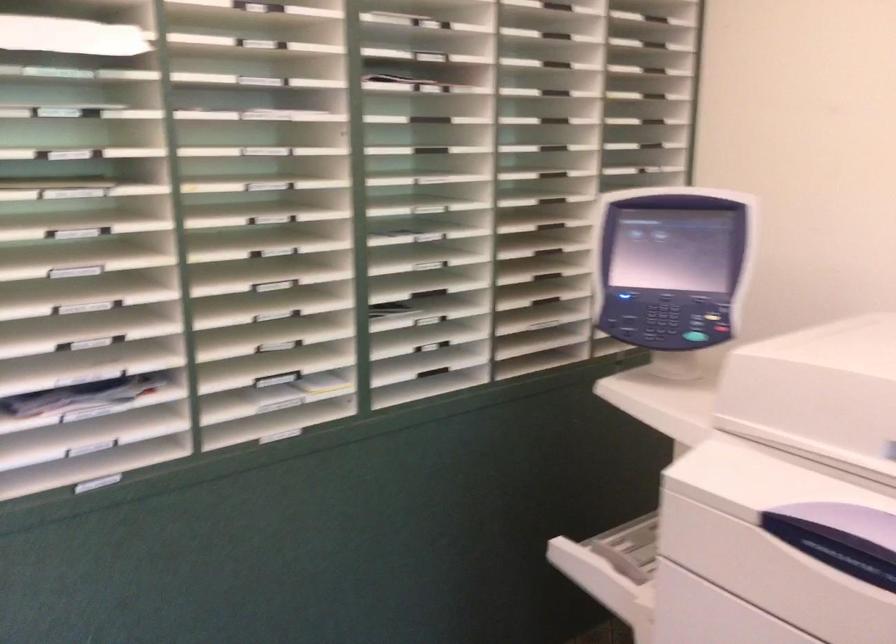
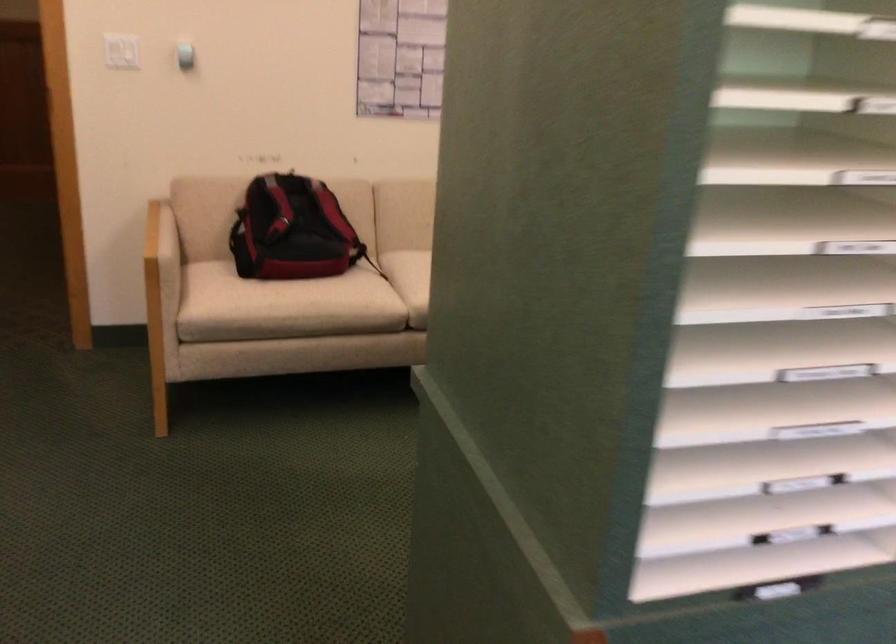
Question: The images are taken continuously from a first-person perspective. In which direction is your viewpoint rotating?

Choices:
 (A) Left
 (B) Right
 (C) Up
 (D) Down

Answer: (A)